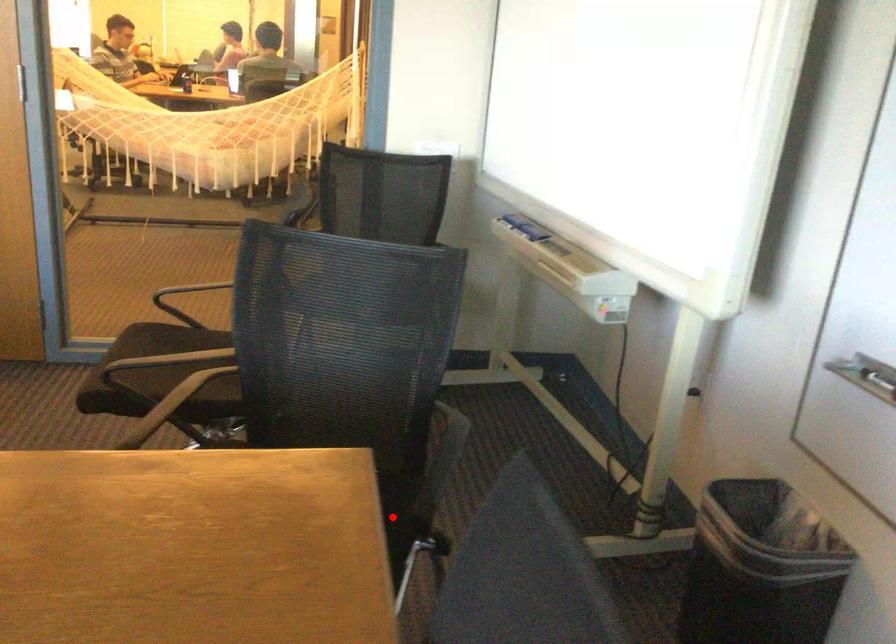
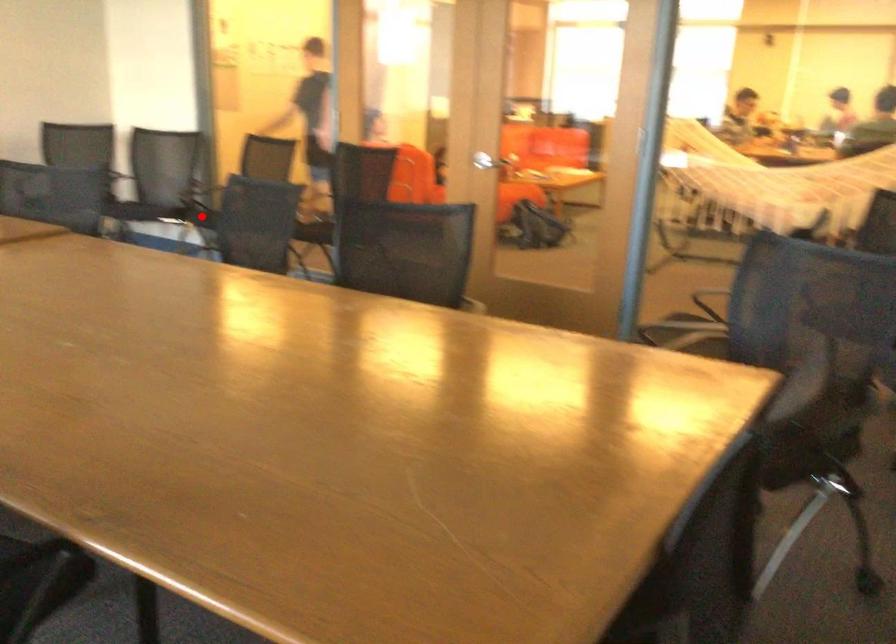
I am providing you with two images of the same scene from different viewpoints. A red point is marked on the first image and another point is marked on the second image. Does the point marked in image1 correspond to the same location as the one in image2?

No